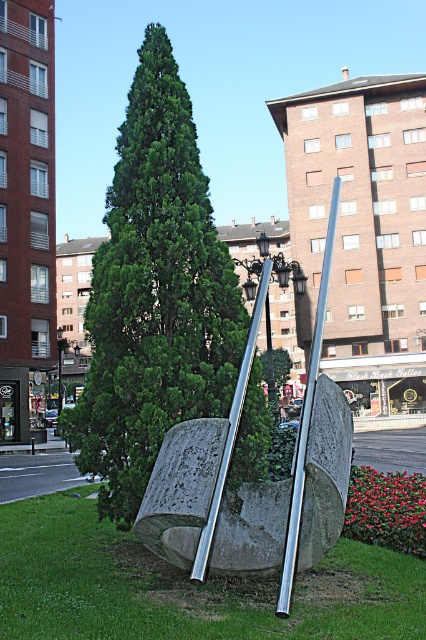
You are holding a camera and standing 5 meters away from the green leafy tree at center. You want to take a photo of the sculpture in the background. Is your current distance sufficient to capture the entire sculpture in the frame?

The green leafy tree at center and camera are 5.09 meters apart from each other. Since you are standing 5 meters away, you are slightly closer than the 5.09 meters required to capture the entire sculpture in the frame. You may need to step back a bit to ensure the entire sculpture fits in the photo.

You are an urban planner assessing the sculpture and pole placement. From your viewpoint, which object is closer to you between the silver polished metal sculpture at center and the polished silver pole at center?

The silver polished metal sculpture at center is closer because it is in front of the polished silver pole at center.

You are standing at the point marked as point (x=184, y=586) in the urban setting. What is the immediate surface you are standing on?

The immediate surface you are standing on is green grass at center, as the point (x=184, y=586) is located there.